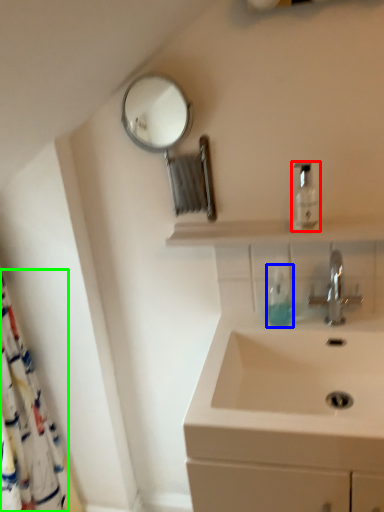
Question: Considering the real-world distances, which object is farthest from mouthwash (highlighted by a red box)? soap dispenser (highlighted by a blue box) or shower curtain (highlighted by a green box)?

Choices:
 (A) soap dispenser
 (B) shower curtain

Answer: (B)